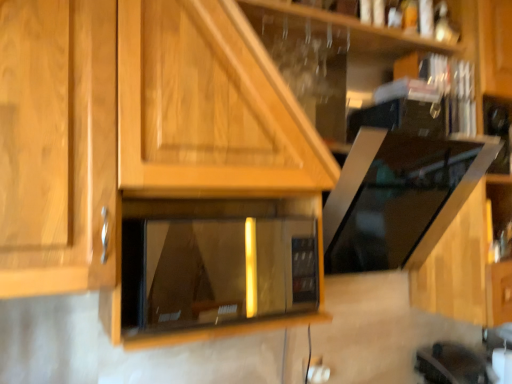
Where is `white plastic electric outlet at lower center`? white plastic electric outlet at lower center is located at coordinates (313, 370).

Where is `matte black microwave at center`? matte black microwave at center is located at coordinates (216, 263).

What do you see at coordinates (216, 263) in the screenshot?
I see `matte black microwave at center` at bounding box center [216, 263].

Measure the distance between point [272,36] and camera.

The distance of point [272,36] from camera is 4.50 feet.

At what (x,y) coordinates should I click in order to perform the action: click on white plastic electric outlet at lower center. Please return your answer as a coordinate pair (x, y). Image resolution: width=512 pixels, height=384 pixels. Looking at the image, I should click on (313, 370).

Which of these two, white plastic electric outlet at lower center or matte black microwave at center, is wider?

Wider between the two is matte black microwave at center.

Is white plastic electric outlet at lower center outside of matte black microwave at center?

Yes, white plastic electric outlet at lower center is located beyond the bounds of matte black microwave at center.

At what (x,y) coordinates should I click in order to perform the action: click on shelf lying behind the matte black microwave at center. Please return your answer as a coordinate pair (x, y). This screenshot has height=384, width=512. Looking at the image, I should click on (329, 57).

From the image's perspective, is wooden at upper center located above matte black microwave at center?

Correct, wooden at upper center appears higher than matte black microwave at center in the image.

From the picture: Could you tell me if wooden at upper center is turned towards matte black microwave at center?

No, wooden at upper center is not turned towards matte black microwave at center.

How much distance is there between wooden at upper center and matte black microwave at center?

A distance of 2.26 meters exists between wooden at upper center and matte black microwave at center.

From a real-world perspective, is white plastic electric outlet at lower center positioned above or below wooden at upper center?

Clearly, from a real-world perspective, white plastic electric outlet at lower center is below wooden at upper center.

Are white plastic electric outlet at lower center and wooden at upper center beside each other?

They are not placed beside each other.

Can you confirm if white plastic electric outlet at lower center is bigger than wooden at upper center?

Incorrect, white plastic electric outlet at lower center is not larger than wooden at upper center.

Which is further, (315, 362) or (287, 10)?

The point (315, 362) is farther.

Consider the image. Is wooden at upper center a part of matte black microwave at center?

No, wooden at upper center is located outside of matte black microwave at center.

Are matte black microwave at center and wooden at upper center making contact?

No, matte black microwave at center is not with wooden at upper center.

Where is `appliance located on the left of white plastic electric outlet at lower center`? appliance located on the left of white plastic electric outlet at lower center is located at coordinates (216, 263).

Is matte black microwave at center at the right side of white plastic electric outlet at lower center?

No.

From the picture: From the image's perspective, does matte black microwave at center appear lower than white plastic electric outlet at lower center?

No, from the image's perspective, matte black microwave at center is not beneath white plastic electric outlet at lower center.

Based on the photo, is matte black microwave at center touching white plastic electric outlet at lower center?

matte black microwave at center is not next to white plastic electric outlet at lower center, and they're not touching.

Is the position of wooden at upper center more distant than that of white plastic electric outlet at lower center?

That is False.

Is white plastic electric outlet at lower center inside wooden at upper center?

Actually, white plastic electric outlet at lower center is outside wooden at upper center.

What's the angular difference between wooden at upper center and white plastic electric outlet at lower center's facing directions?

The facing directions of wooden at upper center and white plastic electric outlet at lower center are 1.96 degrees apart.

Considering the positions of objects wooden at upper center and white plastic electric outlet at lower center in the image provided, who is more to the right, wooden at upper center or white plastic electric outlet at lower center?

Positioned to the right is wooden at upper center.

Where is `electric outlet on the right of matte black microwave at center`? Image resolution: width=512 pixels, height=384 pixels. electric outlet on the right of matte black microwave at center is located at coordinates (313, 370).

This screenshot has height=384, width=512. I want to click on appliance that is in front of the wooden at upper center, so click(216, 263).

Estimate the real-world distances between objects in this image. Which object is further from matte black microwave at center, white plastic electric outlet at lower center or wooden at upper center?

Based on the image, white plastic electric outlet at lower center appears to be further to matte black microwave at center.

When comparing their distances from wooden at upper center, does white plastic electric outlet at lower center or matte black microwave at center seem closer?

white plastic electric outlet at lower center is positioned closer to the anchor wooden at upper center.

Which object lies further to the anchor point matte black microwave at center, wooden at upper center or white plastic electric outlet at lower center?

Based on the image, white plastic electric outlet at lower center appears to be further to matte black microwave at center.

Which object lies further to the anchor point wooden at upper center, matte black microwave at center or white plastic electric outlet at lower center?

matte black microwave at center.

Estimate the real-world distances between objects in this image. Which object is further from white plastic electric outlet at lower center, matte black microwave at center or wooden at upper center?

matte black microwave at center.

From the image, which object appears to be farther from white plastic electric outlet at lower center, wooden at upper center or matte black microwave at center?

matte black microwave at center.

Where is `appliance between wooden at upper center and white plastic electric outlet at lower center from top to bottom`? The height and width of the screenshot is (384, 512). appliance between wooden at upper center and white plastic electric outlet at lower center from top to bottom is located at coordinates (216, 263).